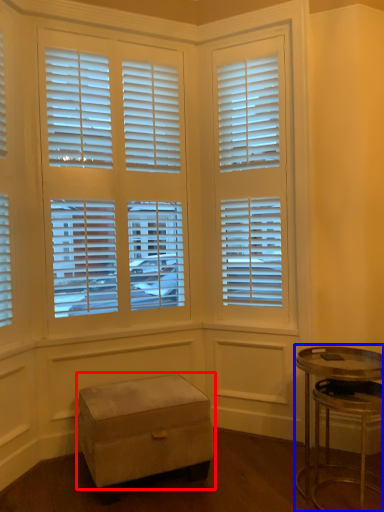
Question: Which point is further to the camera, step stool (highlighted by a red box) or table (highlighted by a blue box)?

Choices:
 (A) step stool
 (B) table

Answer: (A)